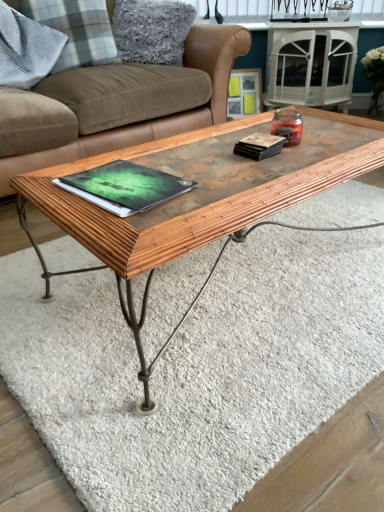
Question: In the image, is gray plaid pillow at upper left, the second pillow from the left, positioned in front of or behind matte black book at upper right, acting as the second book starting from the left?

Choices:
 (A) behind
 (B) front

Answer: (A)

Question: Which is correct: gray plaid pillow at upper left, the second pillow from the left, is inside matte black book at upper right, acting as the first book starting from the top, or outside of it?

Choices:
 (A) inside
 (B) outside

Answer: (B)

Question: Estimate the real-world distances between objects in this image. Which object is closer to the wooden picture frame at upper center?

Choices:
 (A) matte black book at upper right, acting as the first book starting from the top
 (B) brown leather couch at center
 (C) gray plaid pillow at upper left, positioned as the first pillow in left-to-right order
 (D) green matte book at center, arranged as the first book when ordered from the bottom
 (E) gray plaid pillow at upper left, the second pillow from the left

Answer: (B)

Question: Estimate the real-world distances between objects in this image. Which object is closer to the white glossy side table at upper center?

Choices:
 (A) gray plaid pillow at upper left, the second pillow when ordered from right to left
 (B) brown leather couch at center
 (C) wooden textured coffee table at center
 (D) matte black book at upper right, which is the 2th book in bottom-to-top order
 (E) fluffy gray pillow at upper left, the first pillow in the right-to-left sequence

Answer: (E)